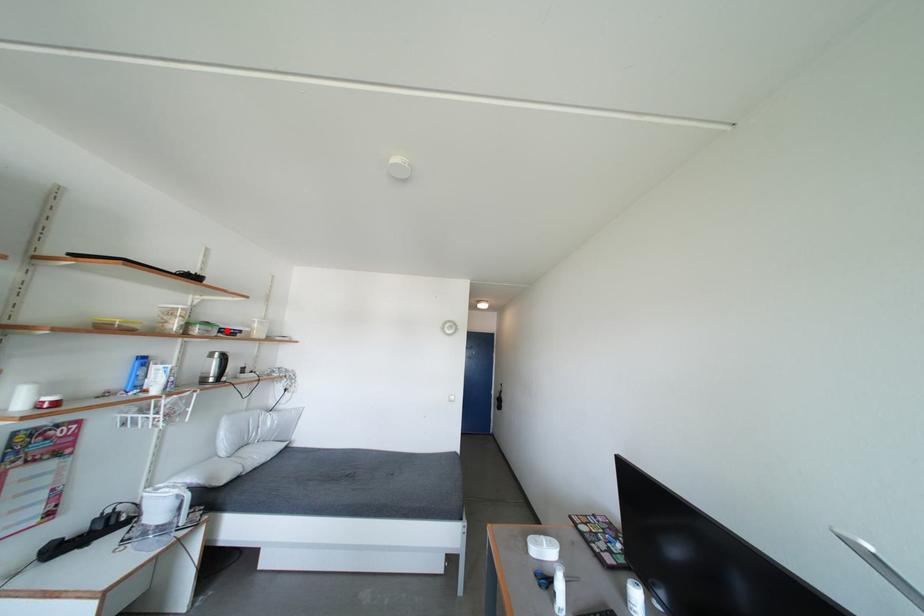
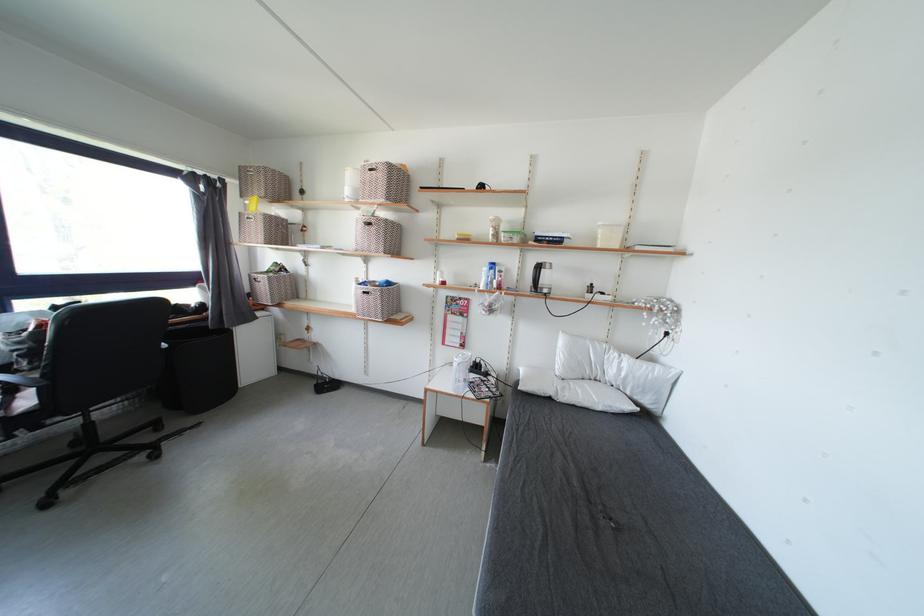
In the second image, find the point that corresponds to the highlighted location in the first image.

(543, 238)